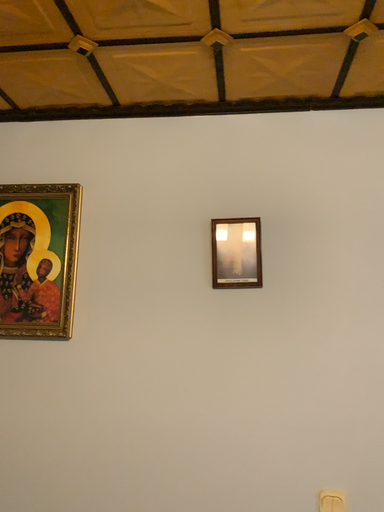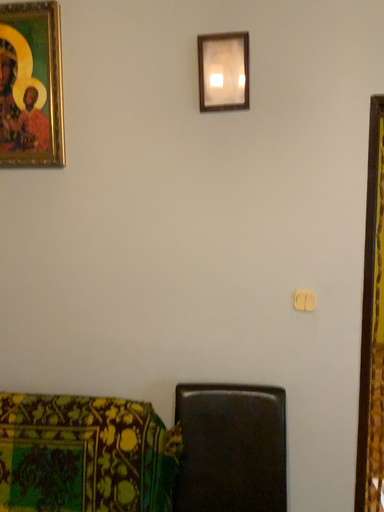
Question: Which way did the camera rotate in the video?

Choices:
 (A) rotated upward
 (B) rotated downward

Answer: (B)